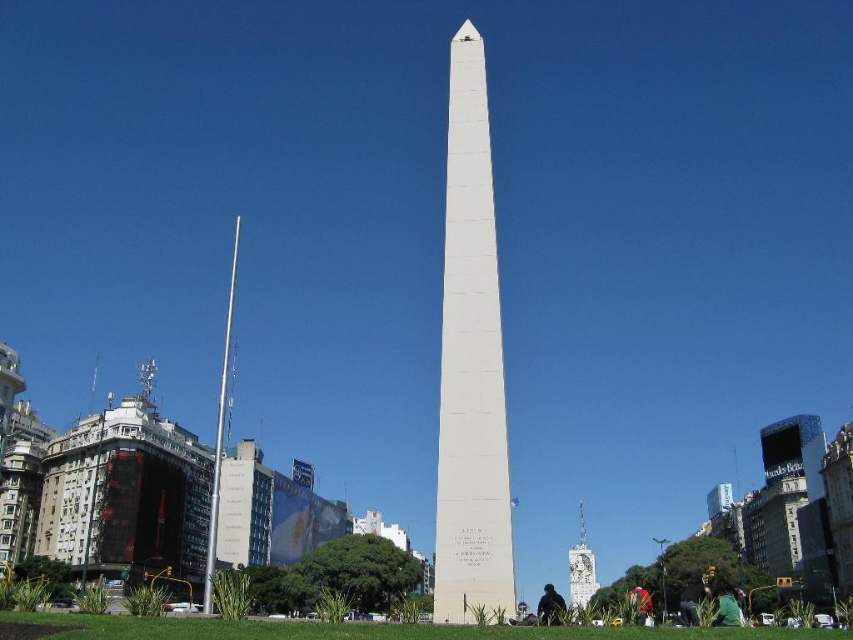
Question: Is white polished stone obelisk at center thinner than black fabric at center?

Choices:
 (A) no
 (B) yes

Answer: (B)

Question: Estimate the real-world distances between objects in this image. Which object is closer to the black fabric at center?

Choices:
 (A) green fabric at lower right
 (B) red fabric bag at lower right
 (C) white polished stone obelisk at center
 (D) white marble obelisk at center

Answer: (D)

Question: Does white marble obelisk at center appear on the left side of green fabric at lower right?

Choices:
 (A) no
 (B) yes

Answer: (A)

Question: Is black fabric at center closer to camera compared to red fabric bag at lower right?

Choices:
 (A) no
 (B) yes

Answer: (B)

Question: Which of the following is the closest to the observer?

Choices:
 (A) (724, 625)
 (B) (579, 513)
 (C) (541, 616)

Answer: (C)

Question: Which point is farther to the camera?

Choices:
 (A) (486, 260)
 (B) (636, 616)
 (C) (718, 612)

Answer: (B)